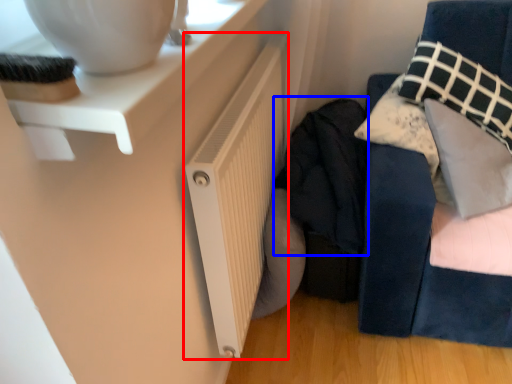
Question: Among these objects, which one is farthest to the camera, radiator (highlighted by a red box) or clothing (highlighted by a blue box)?

Choices:
 (A) radiator
 (B) clothing

Answer: (B)